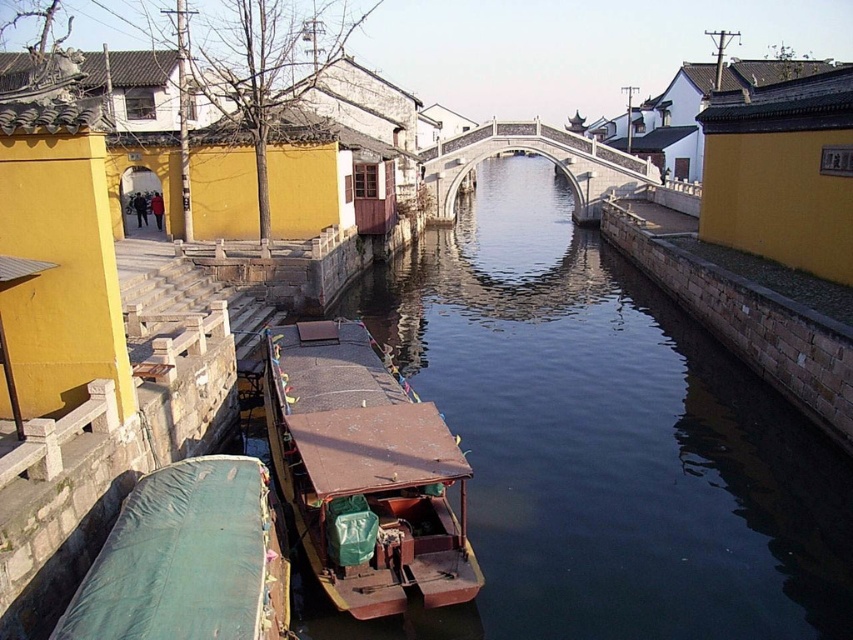
From the picture: Does rusty brown wooden boat at lower center have a smaller size compared to green tarpaulin boat at lower left?

Yes, rusty brown wooden boat at lower center is smaller than green tarpaulin boat at lower left.

Who is more forward, (440, 468) or (257, 536)?

Point (257, 536) is more forward.

Consider the image. Who is more forward, (367, 608) or (263, 579)?

Point (263, 579) is more forward.

Identify the location of rusty brown wooden boat at lower center. This screenshot has height=640, width=853. coord(364,472).

Looking at this image, is rusty brown wooden boat at lower center below white stone bridge at center?

Yes, rusty brown wooden boat at lower center is below white stone bridge at center.

Is rusty brown wooden boat at lower center further to camera compared to white stone bridge at center?

No, it is not.

Is point (347, 497) positioned before point (602, 179)?

Yes, it is in front of point (602, 179).

You are a GUI agent. You are given a task and a screenshot of the screen. Output one action in this format:
    pyautogui.click(x=<x>, y=<y>)
    Task: Click on the rusty brown wooden boat at lower center
    The height and width of the screenshot is (640, 853).
    Given the screenshot: What is the action you would take?
    pyautogui.click(x=364, y=472)

Describe the element at coordinates (602, 442) in the screenshot. I see `smooth dark water at center` at that location.

Between smooth dark water at center and rusty brown wooden boat at lower center, which one has less height?

With less height is rusty brown wooden boat at lower center.

This screenshot has height=640, width=853. Describe the element at coordinates (602, 442) in the screenshot. I see `smooth dark water at center` at that location.

Locate an element on the screen. The image size is (853, 640). smooth dark water at center is located at coordinates (602, 442).